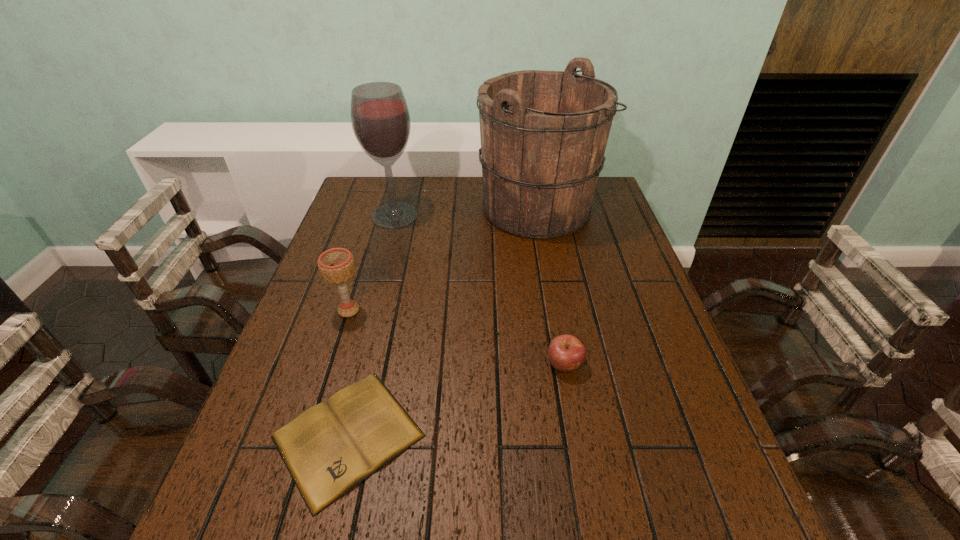
Locate an element on the screen. Image resolution: width=960 pixels, height=540 pixels. vacant area that lies between the fourth tallest object and the bucket is located at coordinates (550, 287).

What are the coordinates of `vacant point located between the third shortest object and the shortest object` in the screenshot? It's located at (348, 373).

You are a GUI agent. You are given a task and a screenshot of the screen. Output one action in this format:
    pyautogui.click(x=<x>, y=<y>)
    Task: Click on the vacant area that lies between the bucket and the fourth tallest object
    Image resolution: width=960 pixels, height=540 pixels.
    Given the screenshot: What is the action you would take?
    pyautogui.click(x=550, y=287)

Where is `vacant area that lies between the alcohol and the third shortest object`? vacant area that lies between the alcohol and the third shortest object is located at coordinates (372, 263).

Locate an element on the screen. object that ranks as the third closest to the second shortest object is located at coordinates (336, 265).

At what (x,y) coordinates should I click in order to perform the action: click on the closest object to the alcohol. Please return your answer as a coordinate pair (x, y). Looking at the image, I should click on (543, 134).

Find the location of `vacant space that satisfies the following two spatial constraints: 1. on the back side of the alcohol; 2. on the left side of the bucket`. vacant space that satisfies the following two spatial constraints: 1. on the back side of the alcohol; 2. on the left side of the bucket is located at coordinates (396, 208).

This screenshot has width=960, height=540. I want to click on free space that satisfies the following two spatial constraints: 1. on the back side of the bucket; 2. on the left side of the third nearest object, so click(x=380, y=208).